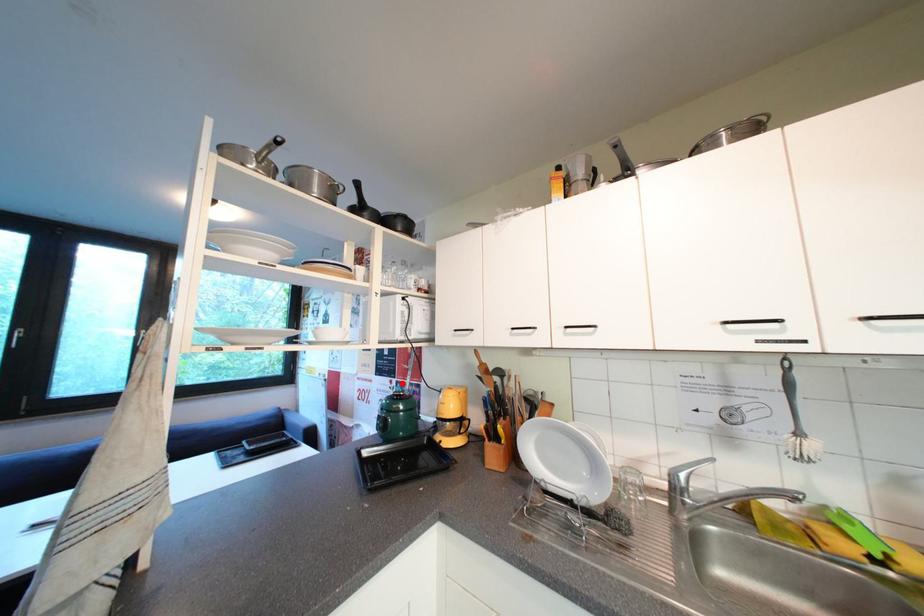
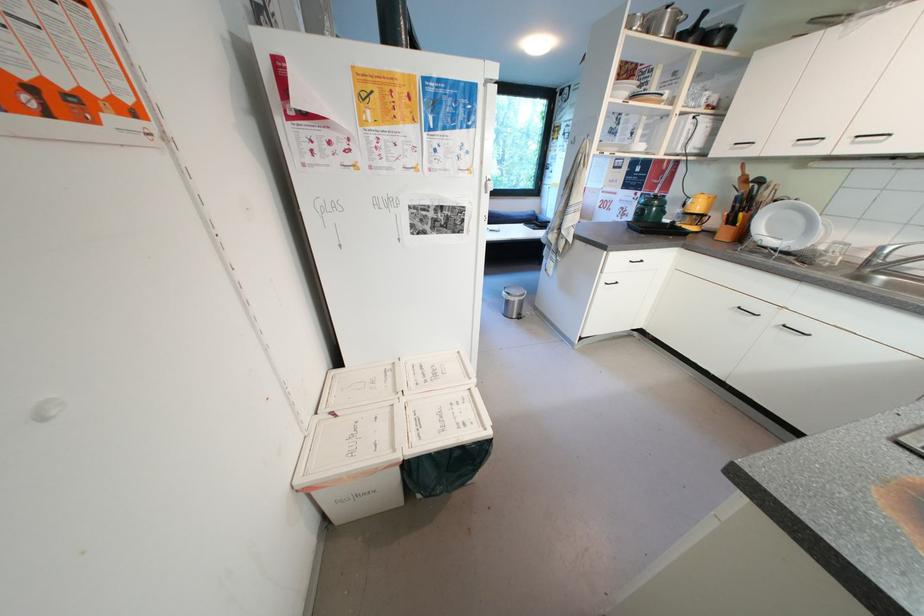
Locate, in the second image, the point that corresponds to the highlighted location in the first image.

(647, 196)